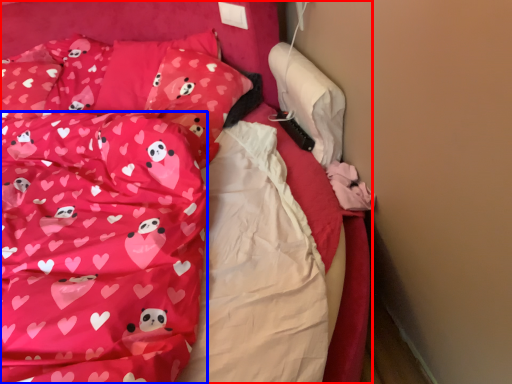
Question: Which of the following is the closest to the observer, bed (highlighted by a red box) or blanket (highlighted by a blue box)?

Choices:
 (A) bed
 (B) blanket

Answer: (B)